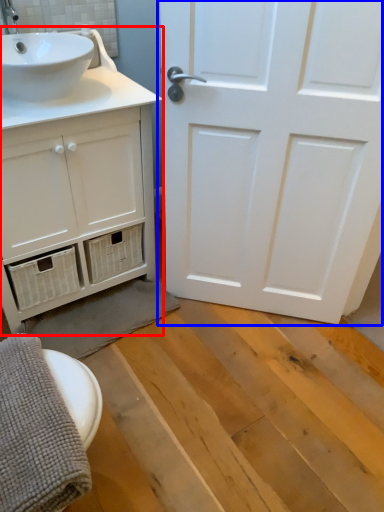
Question: Which point is closer to the camera, bathroom cabinet (highlighted by a red box) or door (highlighted by a blue box)?

Choices:
 (A) bathroom cabinet
 (B) door

Answer: (B)